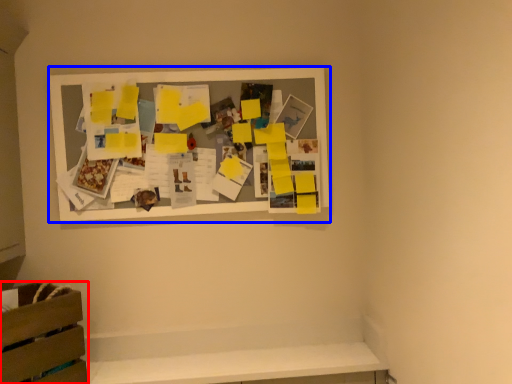
Question: Which of the following is the farthest to the observer, furniture (highlighted by a red box) or picture frame (highlighted by a blue box)?

Choices:
 (A) furniture
 (B) picture frame

Answer: (B)